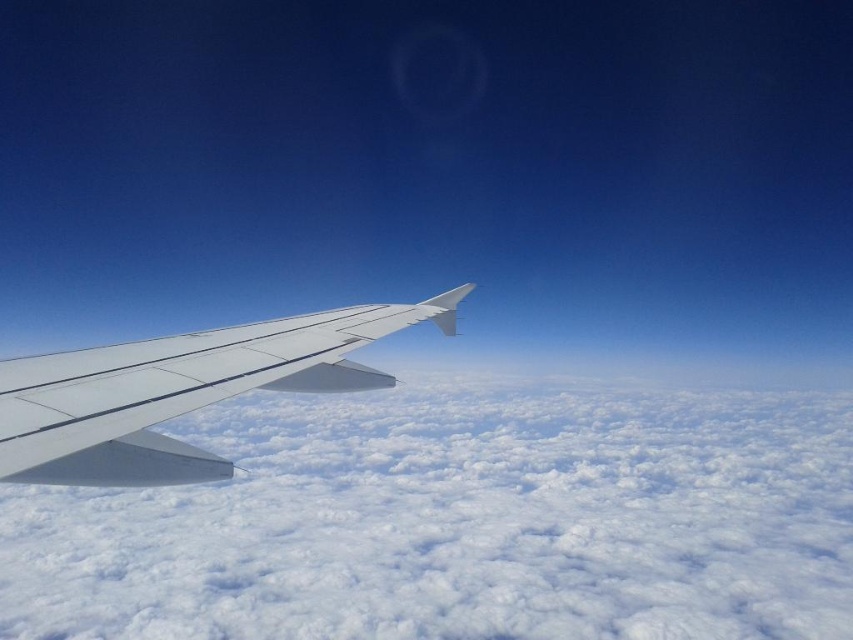
Question: Does white fluffy cloud at lower left appear under white matte wing at lower left?

Choices:
 (A) yes
 (B) no

Answer: (A)

Question: Which point is farther from the camera taking this photo?

Choices:
 (A) (59, 412)
 (B) (541, 632)

Answer: (B)

Question: Is the position of white fluffy cloud at lower left more distant than that of white matte wing at lower left?

Choices:
 (A) no
 (B) yes

Answer: (B)

Question: Is white fluffy cloud at lower left above white matte wing at lower left?

Choices:
 (A) no
 (B) yes

Answer: (A)